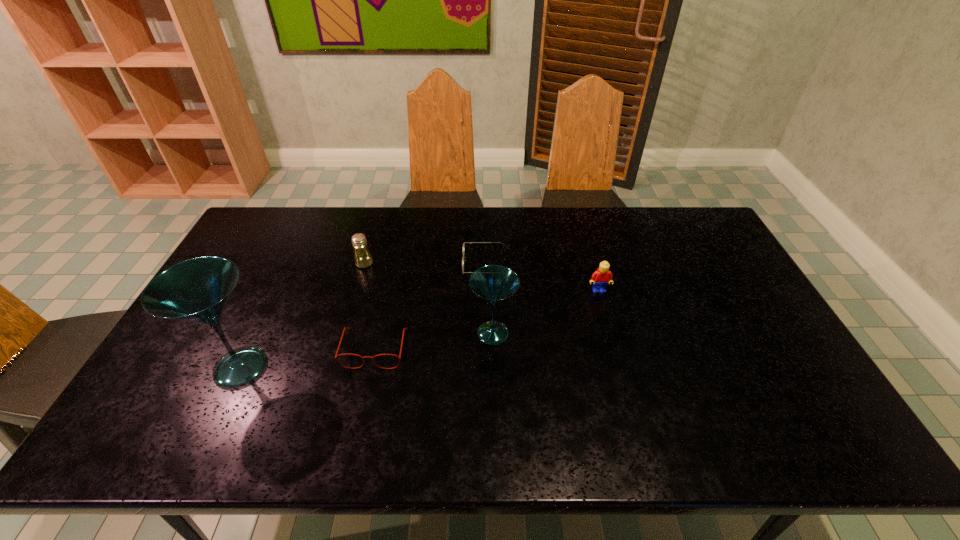
Find the location of `free space located on the back of the second tallest object`. free space located on the back of the second tallest object is located at coordinates (491, 249).

You are a GUI agent. You are given a task and a screenshot of the screen. Output one action in this format:
    pyautogui.click(x=<x>, y=<y>)
    Task: Click on the free space located on the front of the saltshaker
    
    Given the screenshot: What is the action you would take?
    pyautogui.click(x=342, y=342)

Identify the location of vacant area situated on the front-facing side of the fourth nearest object. (623, 376).

What are the coordinates of `vacant space situated on the front-facing side of the sunglasses` in the screenshot? It's located at (432, 265).

Where is `vacant area located on the front-facing side of the sunglasses`? Image resolution: width=960 pixels, height=540 pixels. vacant area located on the front-facing side of the sunglasses is located at coordinates [x=420, y=265].

I want to click on vacant area located 0.070m on the front-facing side of the sunglasses, so [442, 265].

Identify the location of blank space located 0.110m on the face of the fifth tallest object. The image size is (960, 540). (362, 407).

Where is `object located in the near edge section of the desktop`? The image size is (960, 540). object located in the near edge section of the desktop is located at coordinates (197, 290).

Where is `object that is at the left edge`? object that is at the left edge is located at coordinates (197, 290).

What are the coordinates of `object present at the near left corner` in the screenshot? It's located at (197, 290).